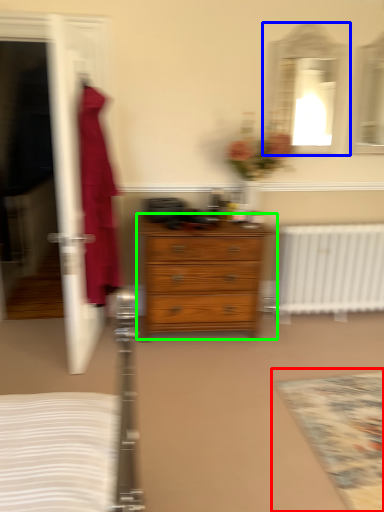
Question: Estimate the real-world distances between objects in this image. Which object is closer to mat (highlighted by a red box), mirror (highlighted by a blue box) or chest of drawers (highlighted by a green box)?

Choices:
 (A) mirror
 (B) chest of drawers

Answer: (B)